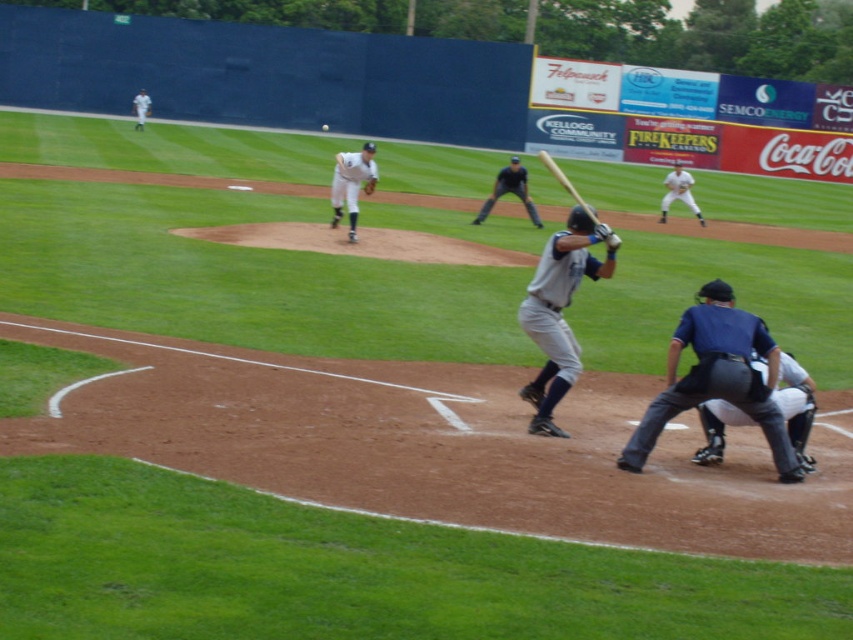
Question: Does white uniformed baseball player at center have a smaller size compared to white matte baseball at center?

Choices:
 (A) yes
 (B) no

Answer: (B)

Question: Which point appears farthest from the camera in this image?

Choices:
 (A) (561, 368)
 (B) (488, 196)

Answer: (B)

Question: Which point is farther to the camera?

Choices:
 (A) gray matte baseball bat at center
 (B) dark gray uniform at center
 (C) dark blue leather glove at lower right
 (D) white uniform at center

Answer: (B)

Question: Is gray matte baseball bat at center below dark blue leather glove at lower right?

Choices:
 (A) yes
 (B) no

Answer: (B)

Question: Is dark gray uniform at center positioned before brown leather glove at center?

Choices:
 (A) no
 (B) yes

Answer: (A)

Question: Estimate the real-world distances between objects in this image. Which object is closer to the white matte baseball at center?

Choices:
 (A) white uniform at center
 (B) dark blue uniform at lower right
 (C) dark gray uniform at center
 (D) white uniformed baseball player at center

Answer: (D)